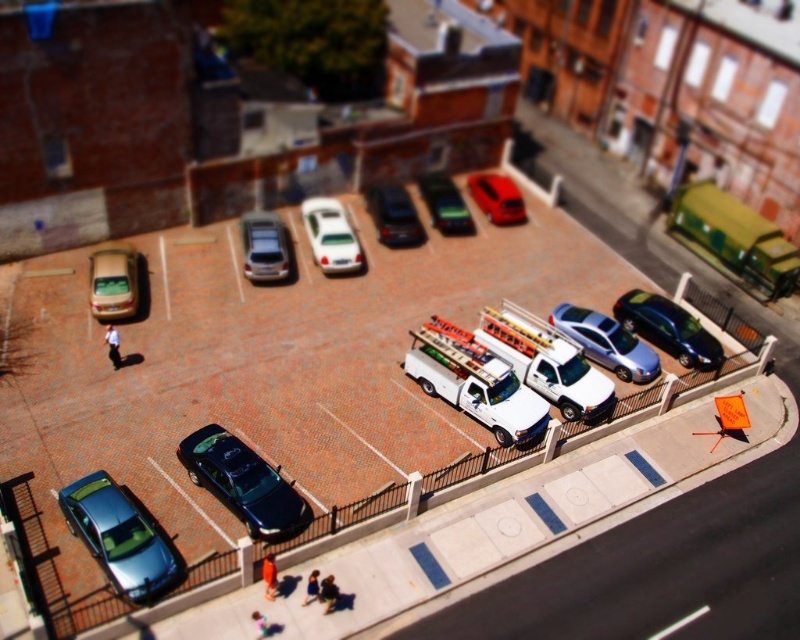
Is shiny black car at center thinner than metallic silver van at center?

Incorrect, shiny black car at center's width is not less than metallic silver van at center's.

Between shiny black car at center and metallic silver van at center, which one is positioned higher?

Positioned higher is metallic silver van at center.

Identify the location of shiny black car at center. The image size is (800, 640). (256, 371).

Does shiny dark blue sedan at center-left have a larger size compared to satin black sedan at center?

Correct, shiny dark blue sedan at center-left is larger in size than satin black sedan at center.

Between point (304, 525) and point (374, 208), which one is positioned behind?

The point (374, 208) is behind.

Measure the distance between shiny dark blue sedan at center-left and camera.

They are 19.73 meters apart.

Locate an element on the screen. The width and height of the screenshot is (800, 640). shiny dark blue sedan at center-left is located at coordinates (244, 483).

Is shiny metallic sedan at lower left further to the viewer compared to satin black sedan at center?

No, it is in front of satin black sedan at center.

Is shiny metallic sedan at lower left below satin black sedan at center?

Correct, shiny metallic sedan at lower left is located below satin black sedan at center.

Measure the distance between shiny metallic sedan at lower left and camera.

They are 17.91 meters apart.

The width and height of the screenshot is (800, 640). I want to click on shiny metallic sedan at lower left, so [x=118, y=536].